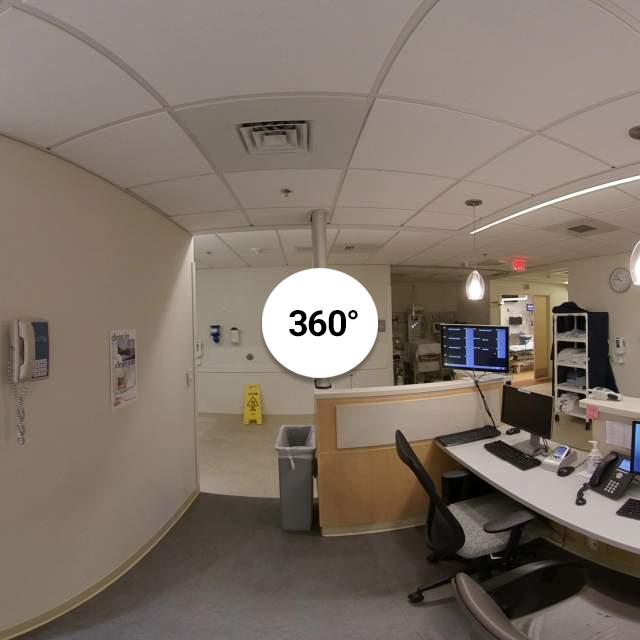
The width and height of the screenshot is (640, 640). I want to click on keyboard, so click(x=468, y=435), click(x=509, y=452), click(x=630, y=507).